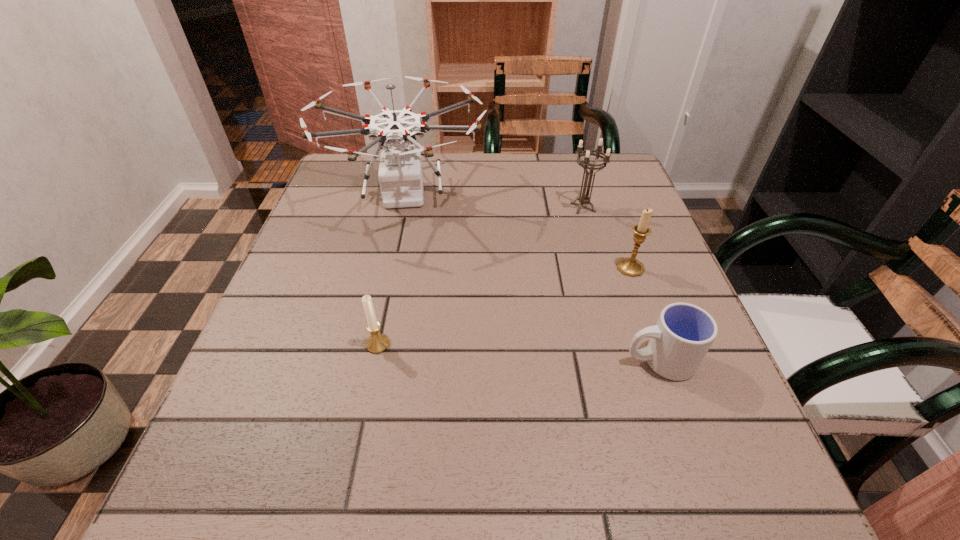
What are the coordinates of `the tallest object` in the screenshot? It's located at coord(400,174).

This screenshot has height=540, width=960. Find the location of `the farthest candle holder`. the farthest candle holder is located at coordinates (584, 199).

Identify the location of the second nearest candle holder. (630, 266).

Image resolution: width=960 pixels, height=540 pixels. Identify the location of the nearest candle holder. (378, 342).

Identify the location of the shortest candle holder. The width and height of the screenshot is (960, 540). (378, 342).

Where is `the shortest object`? the shortest object is located at coordinates (684, 332).

Where is `vacant area situated on the right of the drone`? This screenshot has width=960, height=540. vacant area situated on the right of the drone is located at coordinates (514, 194).

This screenshot has width=960, height=540. What are the coordinates of `vacant space located 0.390m on the left of the farthest candle holder` in the screenshot? It's located at (409, 207).

Find the location of a particular element. The height and width of the screenshot is (540, 960). blank area located on the left of the third farthest object is located at coordinates (497, 268).

At what (x,y) coordinates should I click in order to perform the action: click on free space located 0.200m on the front of the nearest candle holder. Please return your answer as a coordinate pair (x, y). The image size is (960, 540). Looking at the image, I should click on (352, 470).